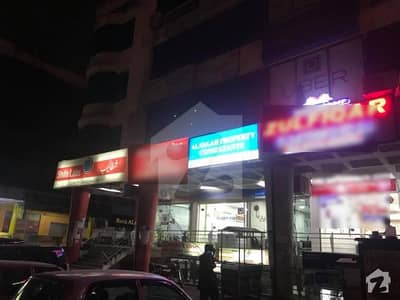
At what (x,y) coordinates should I click in order to perform the action: click on stairs. Please return your answer as a coordinate pair (x, y). The width and height of the screenshot is (400, 300). Looking at the image, I should click on (98, 253).